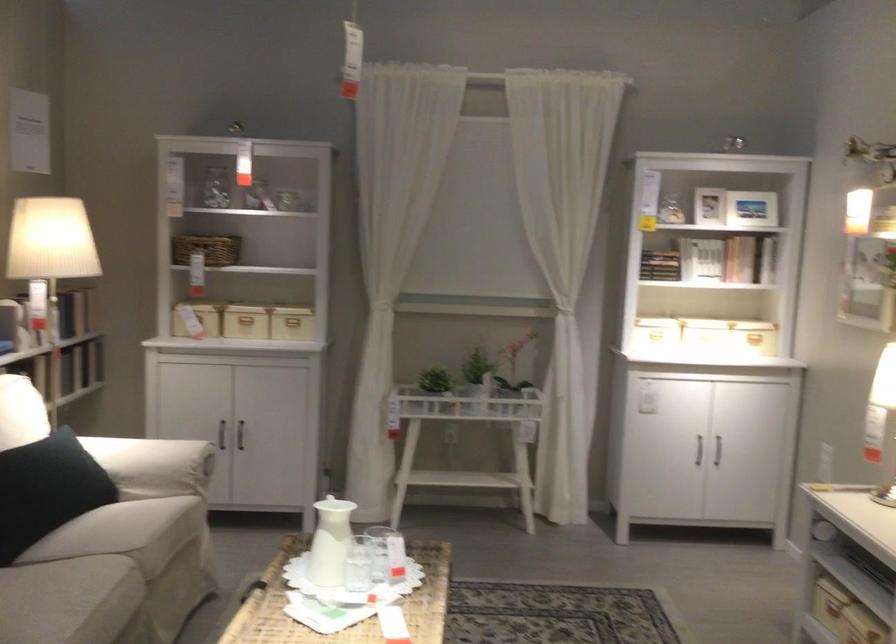
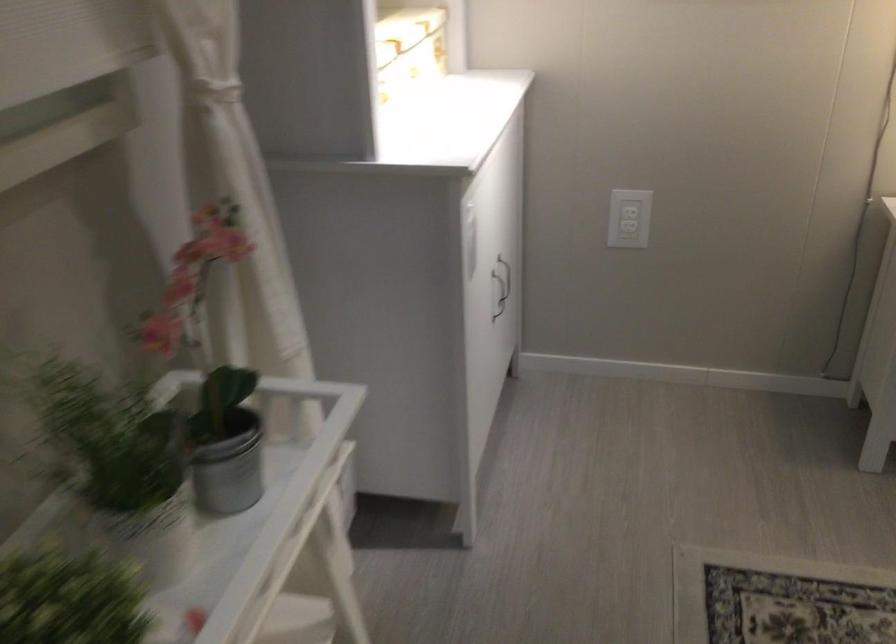
In the second image, find the point that corresponds to (747,446) in the first image.

(501, 292)